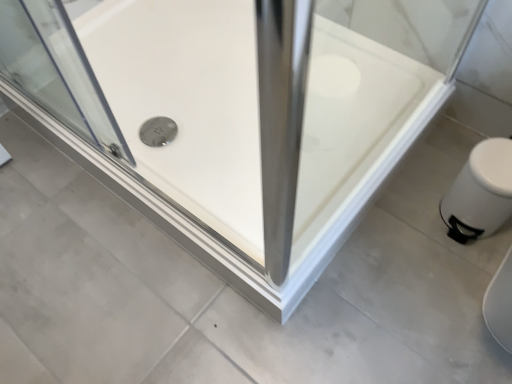
Find the location of a particular element. The image size is (512, 384). white plastic toilet bowl at right is located at coordinates (480, 192).

Describe the element at coordinates (480, 192) in the screenshot. I see `white plastic toilet bowl at right` at that location.

Measure the distance between white plastic toilet bowl at right and camera.

white plastic toilet bowl at right is 1.01 meters from camera.

I want to click on white plastic toilet bowl at right, so click(x=480, y=192).